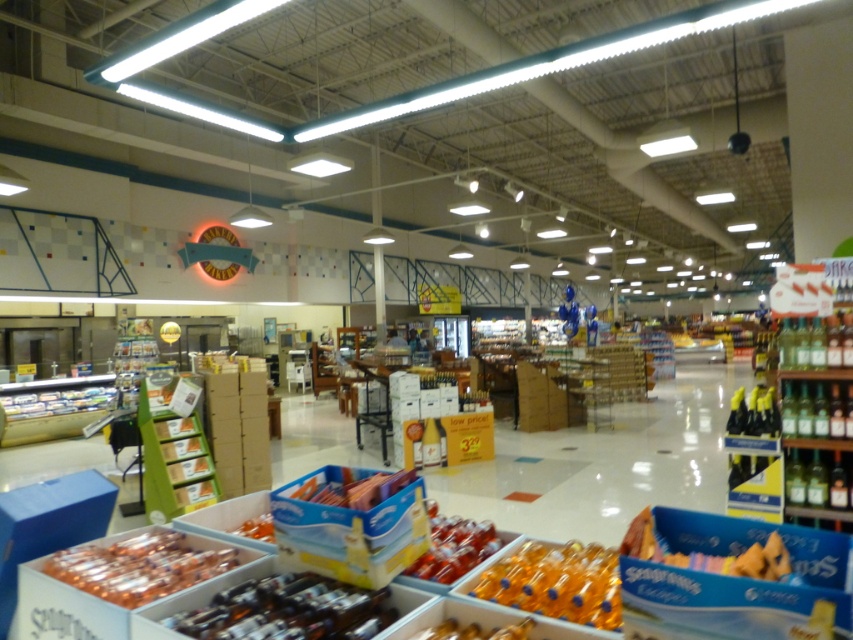
Who is more distant from viewer, (416, 529) or (91, 557)?

Positioned behind is point (91, 557).

Can you confirm if blue cardboard box at center is wider than translucent plastic bottles at lower left?

In fact, blue cardboard box at center might be narrower than translucent plastic bottles at lower left.

You are a GUI agent. You are given a task and a screenshot of the screen. Output one action in this format:
    pyautogui.click(x=<x>, y=<y>)
    Task: Click on the blue cardboard box at center
    Image resolution: width=853 pixels, height=640 pixels.
    Given the screenshot: What is the action you would take?
    pyautogui.click(x=347, y=529)

Locate an element on the screen. blue cardboard box at center is located at coordinates (347, 529).

Can you confirm if translucent plastic bottles at center is thinner than smooth plastic candy at center?

No.

Who is more distant from viewer, (x=345, y=634) or (x=300, y=499)?

The point (x=300, y=499) is more distant.

Who is more forward, (x=323, y=636) or (x=300, y=496)?

Point (x=323, y=636) is more forward.

Locate an element on the screen. The height and width of the screenshot is (640, 853). translucent plastic bottles at center is located at coordinates (288, 611).

How distant is translucent orange bottle at lower center from smooth plastic candy at center?

translucent orange bottle at lower center is 59.40 centimeters from smooth plastic candy at center.

Which of these two, translucent orange bottle at lower center or smooth plastic candy at center, stands shorter?

Standing shorter between the two is translucent orange bottle at lower center.

Is point (575, 557) positioned in front of point (331, 500)?

No, (575, 557) is behind (331, 500).

Identify the location of translucent orange bottle at lower center. The image size is (853, 640). (556, 582).